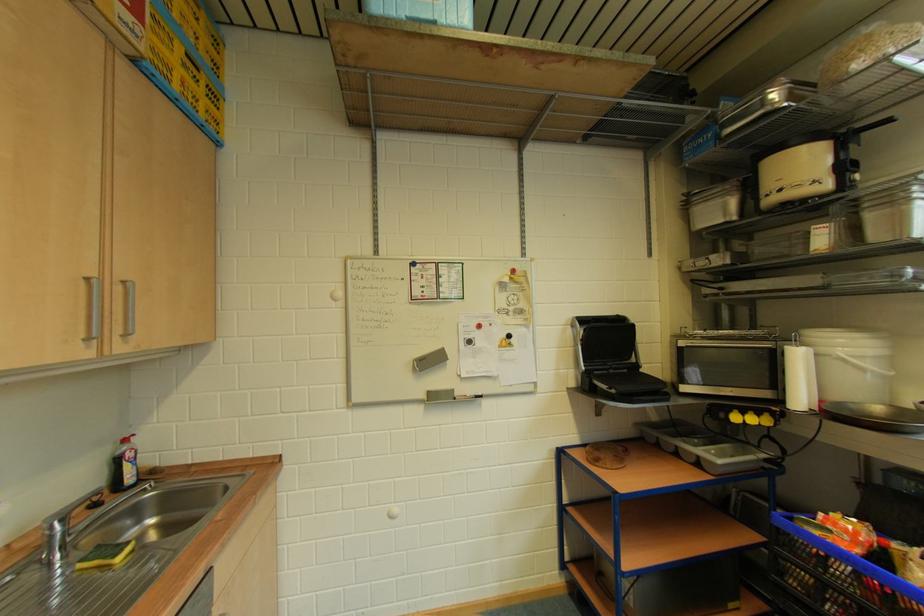
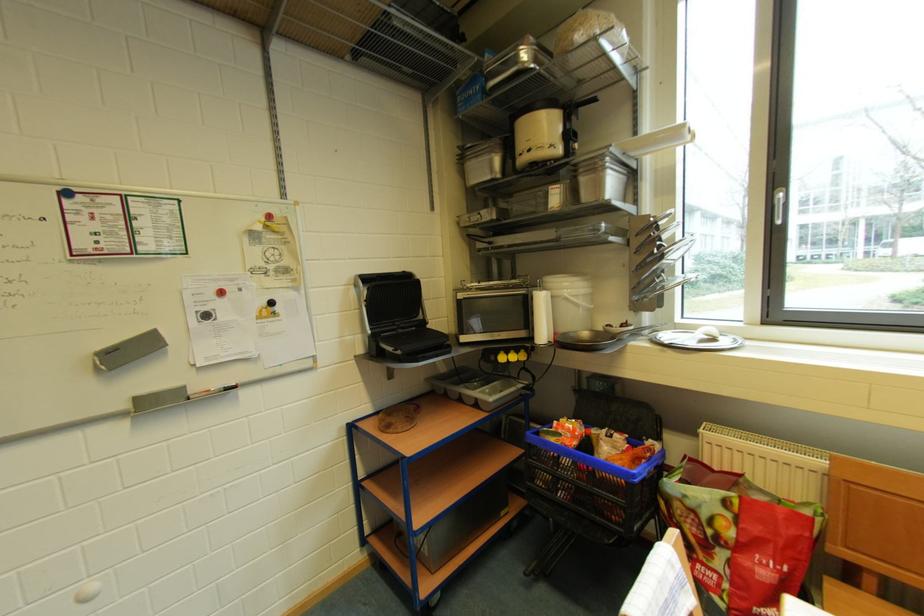
Locate, in the second image, the point that corresponds to pixel 728 419 in the first image.

(500, 361)